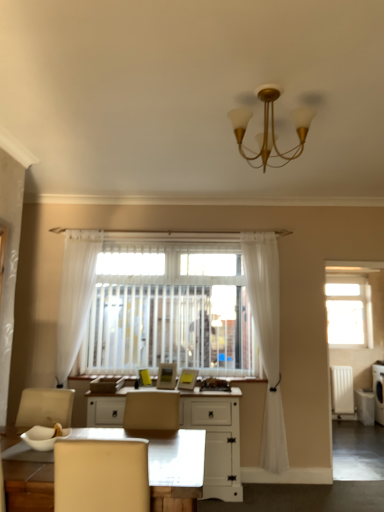
Question: Which direction should I rotate to look at matte yellow picture frame at center, which is the first picture frame from right to left?

Choices:
 (A) left
 (B) right

Answer: (A)

Question: Considering the relative sizes of white sheer curtain at center, which ranks as the second curtain in left-to-right order, and white plastic radiator at right in the image provided, is white sheer curtain at center, which ranks as the second curtain in left-to-right order, shorter than white plastic radiator at right?

Choices:
 (A) no
 (B) yes

Answer: (A)

Question: From a real-world perspective, is white sheer curtain at center, which ranks as the second curtain in left-to-right order, over white plastic radiator at right?

Choices:
 (A) no
 (B) yes

Answer: (B)

Question: Is the depth of white sheer curtain at center, the first curtain when ordered from right to left, greater than that of white plastic radiator at right?

Choices:
 (A) yes
 (B) no

Answer: (B)

Question: Can you confirm if white sheer curtain at center, which ranks as the second curtain in left-to-right order, is taller than white plastic radiator at right?

Choices:
 (A) yes
 (B) no

Answer: (A)

Question: From the image's perspective, is white sheer curtain at center, which ranks as the second curtain in left-to-right order, over white plastic radiator at right?

Choices:
 (A) no
 (B) yes

Answer: (B)

Question: Is white sheer curtain at center, the first curtain when ordered from right to left, at the right side of white plastic radiator at right?

Choices:
 (A) yes
 (B) no

Answer: (B)

Question: Can matte yellow picture frame at center, which is the first picture frame from right to left, be found inside matte yellow picture frame at center, marked as the 1th picture frame in a left-to-right arrangement?

Choices:
 (A) yes
 (B) no

Answer: (B)

Question: Is matte yellow picture frame at center, which is the first picture frame from right to left, at the back of matte yellow picture frame at center, which appears as the 2th picture frame when viewed from the right?

Choices:
 (A) yes
 (B) no

Answer: (B)

Question: From a real-world perspective, is matte yellow picture frame at center, which appears as the 2th picture frame when viewed from the right, physically below matte yellow picture frame at center, the second picture frame viewed from the left?

Choices:
 (A) no
 (B) yes

Answer: (A)

Question: Would you say matte yellow picture frame at center, marked as the 1th picture frame in a left-to-right arrangement, is outside matte yellow picture frame at center, which is the first picture frame from right to left?

Choices:
 (A) yes
 (B) no

Answer: (A)

Question: Is matte yellow picture frame at center, marked as the 1th picture frame in a left-to-right arrangement, to the right of matte yellow picture frame at center, the second picture frame viewed from the left, from the viewer's perspective?

Choices:
 (A) yes
 (B) no

Answer: (B)

Question: Is matte yellow picture frame at center, which appears as the 2th picture frame when viewed from the right, next to matte yellow picture frame at center, the second picture frame viewed from the left?

Choices:
 (A) yes
 (B) no

Answer: (B)

Question: From a real-world perspective, is white plastic radiator at right beneath gold metallic chandelier at upper center?

Choices:
 (A) no
 (B) yes

Answer: (B)